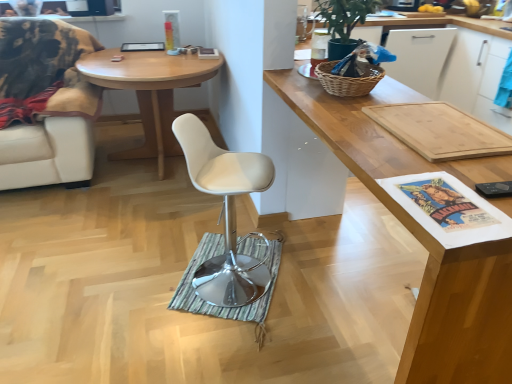
Question: Does white leather swivel chair at center appear on the left side of green matte plant at upper right?

Choices:
 (A) yes
 (B) no

Answer: (A)

Question: Is white leather swivel chair at center not near green matte plant at upper right?

Choices:
 (A) yes
 (B) no

Answer: (A)

Question: From the image's perspective, would you say white leather swivel chair at center is positioned over green matte plant at upper right?

Choices:
 (A) no
 (B) yes

Answer: (A)

Question: Can you see white leather swivel chair at center touching green matte plant at upper right?

Choices:
 (A) no
 (B) yes

Answer: (A)

Question: Is white leather swivel chair at center surrounding green matte plant at upper right?

Choices:
 (A) yes
 (B) no

Answer: (B)

Question: Can you confirm if white leather swivel chair at center is positioned to the right of green matte plant at upper right?

Choices:
 (A) yes
 (B) no

Answer: (B)

Question: Considering the relative sizes of woven wicker picnic basket at upper right and white leather chair at left in the image provided, is woven wicker picnic basket at upper right bigger than white leather chair at left?

Choices:
 (A) no
 (B) yes

Answer: (A)

Question: Would you say white leather chair at left is part of woven wicker picnic basket at upper right's contents?

Choices:
 (A) yes
 (B) no

Answer: (B)

Question: Is woven wicker picnic basket at upper right oriented towards white leather chair at left?

Choices:
 (A) yes
 (B) no

Answer: (B)

Question: From a real-world perspective, is woven wicker picnic basket at upper right physically above white leather chair at left?

Choices:
 (A) yes
 (B) no

Answer: (A)

Question: From a real-world perspective, does woven wicker picnic basket at upper right sit lower than white leather chair at left?

Choices:
 (A) no
 (B) yes

Answer: (A)

Question: Is woven wicker picnic basket at upper right turned away from white leather chair at left?

Choices:
 (A) no
 (B) yes

Answer: (A)

Question: Considering the relative sizes of green striped mat at center and woven wicker picnic basket at upper right in the image provided, is green striped mat at center smaller than woven wicker picnic basket at upper right?

Choices:
 (A) yes
 (B) no

Answer: (B)